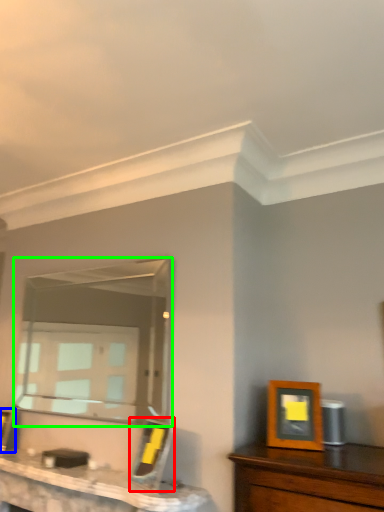
Question: Which object is positioned closest to picture frame (highlighted by a red box)? Select from picture frame (highlighted by a blue box) and mirror (highlighted by a green box).

Choices:
 (A) picture frame
 (B) mirror

Answer: (A)